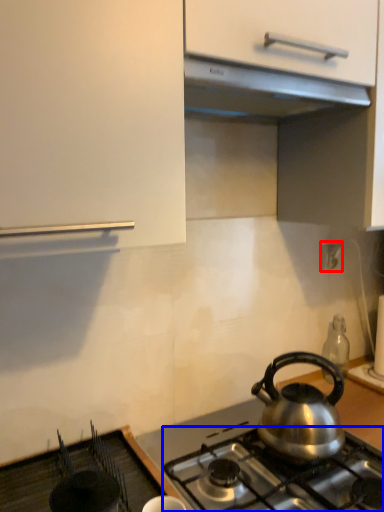
Question: Among these objects, which one is nearest to the camera, electric outlet (highlighted by a red box) or gas stove (highlighted by a blue box)?

Choices:
 (A) electric outlet
 (B) gas stove

Answer: (B)